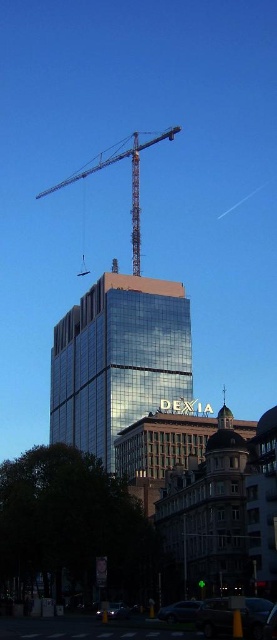
Based on the photo, is shiny glass tower at center behind metallic gray crane at upper center?

No, it is not.

Image resolution: width=277 pixels, height=640 pixels. I want to click on shiny glass tower at center, so click(118, 358).

Is metallic silver car at lower right taller than metallic gray crane at upper center?

Incorrect, metallic silver car at lower right's height is not larger of metallic gray crane at upper center's.

Between metallic silver car at lower right and metallic gray crane at upper center, which one is positioned higher?

metallic gray crane at upper center is higher up.

The width and height of the screenshot is (277, 640). I want to click on metallic silver car at lower right, so click(x=214, y=618).

This screenshot has height=640, width=277. I want to click on metallic silver car at lower right, so click(214, 618).

Is metallic silver car at lower right bigger than shiny black car at lower center?

Actually, metallic silver car at lower right might be smaller than shiny black car at lower center.

What do you see at coordinates (214, 618) in the screenshot?
I see `metallic silver car at lower right` at bounding box center [214, 618].

Locate an element on the screen. metallic silver car at lower right is located at coordinates (214, 618).